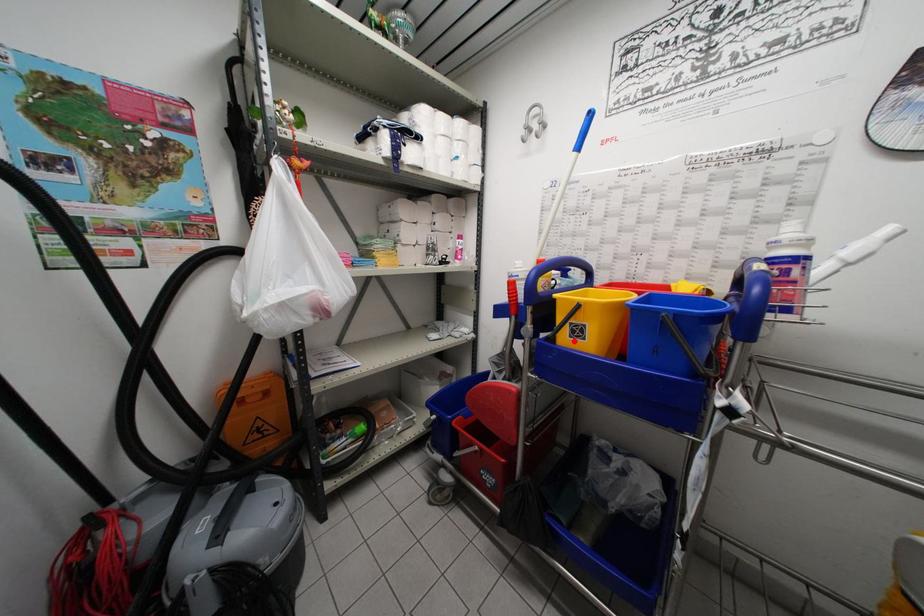
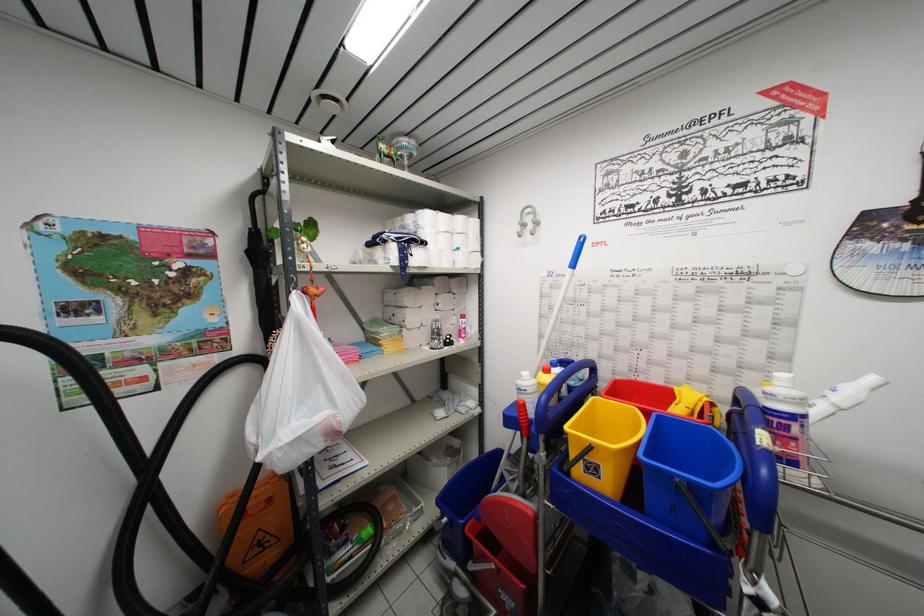
In the second image, find the point that corresponds to the highlighted location in the first image.

(589, 477)